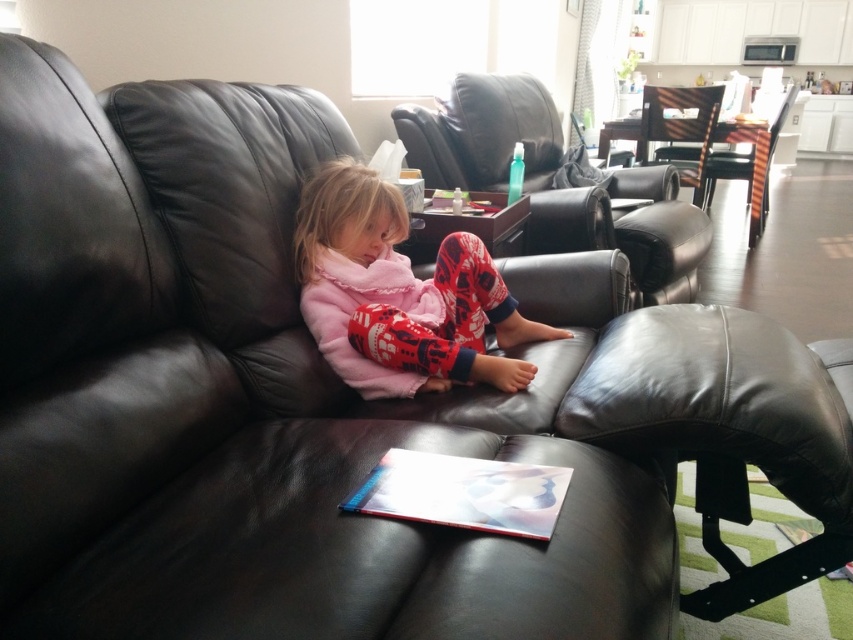
Does matte black armchair at center have a greater height compared to striped wood chair at center?

No, matte black armchair at center is not taller than striped wood chair at center.

This screenshot has height=640, width=853. I want to click on matte black armchair at center, so click(x=483, y=132).

The image size is (853, 640). I want to click on matte black armchair at center, so click(483, 132).

Does matte black armchair at center have a greater width compared to wooden chair at center?

Yes, matte black armchair at center is wider than wooden chair at center.

Does matte black armchair at center have a greater height compared to wooden chair at center?

Yes.

Locate an element on the screen. The width and height of the screenshot is (853, 640). matte black armchair at center is located at coordinates (483, 132).

Is pink fleece pajamas at center thinner than striped wood chair at center?

Yes, pink fleece pajamas at center is thinner than striped wood chair at center.

Is pink fleece pajamas at center to the right of striped wood chair at center from the viewer's perspective?

In fact, pink fleece pajamas at center is to the left of striped wood chair at center.

Between point (437, 266) and point (753, 163), which one is positioned behind?

Point (753, 163)

Where is `pink fleece pajamas at center`? Image resolution: width=853 pixels, height=640 pixels. pink fleece pajamas at center is located at coordinates (399, 294).